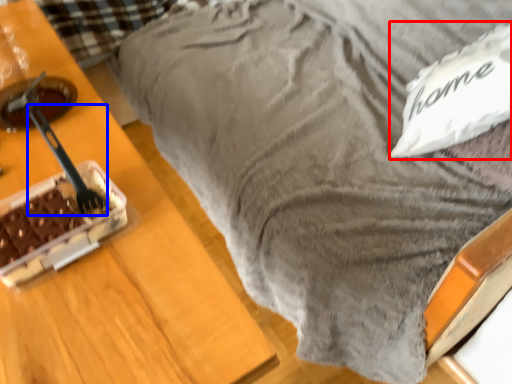
Question: Which object is further to the camera taking this photo, pillow (highlighted by a red box) or utensil (highlighted by a blue box)?

Choices:
 (A) pillow
 (B) utensil

Answer: (A)